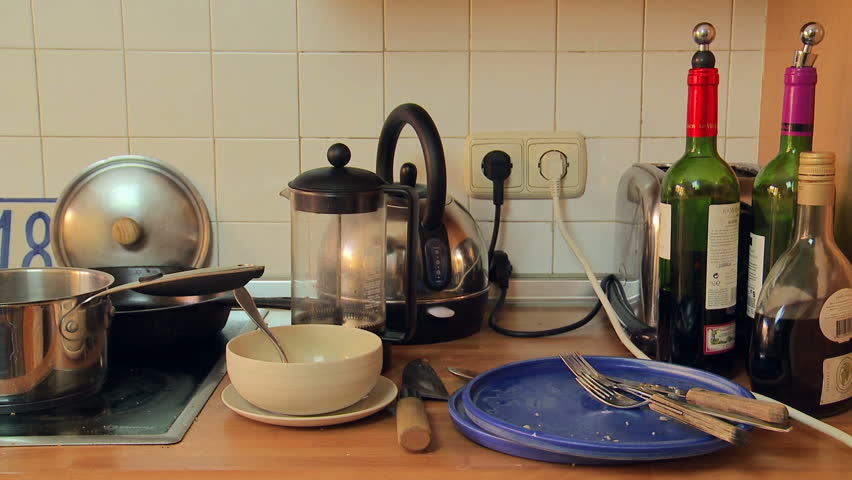
The image size is (852, 480). I want to click on bottles of wine, so click(x=705, y=185), click(x=790, y=155), click(x=809, y=284).